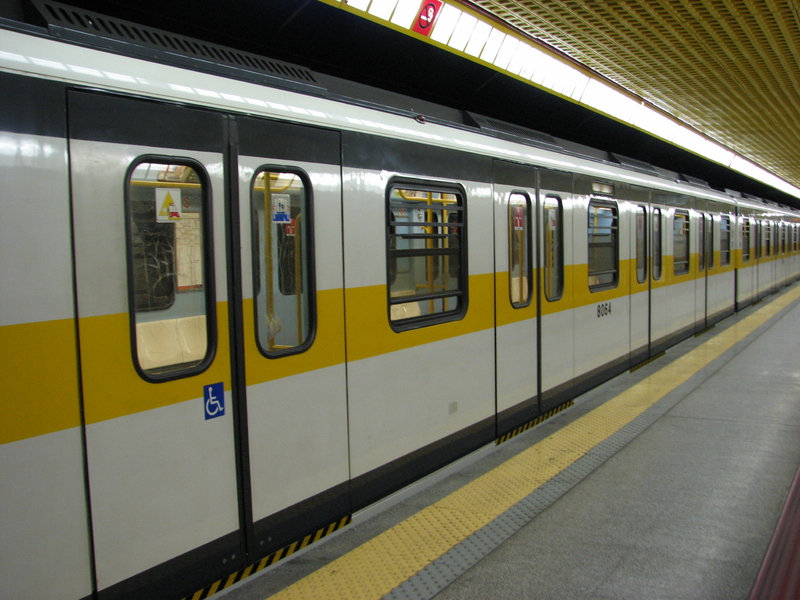
This screenshot has width=800, height=600. I want to click on door, so click(698, 500).